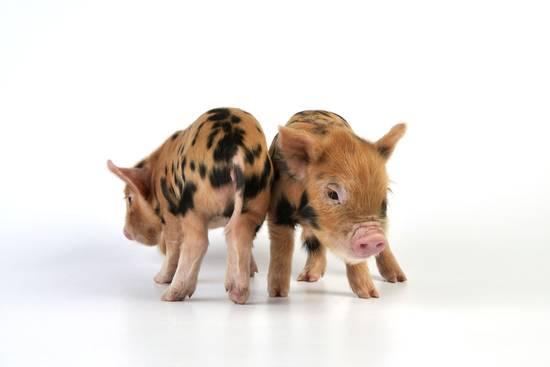
The image size is (550, 367). In order to click on floor in this screenshot , I will do `click(310, 293)`.